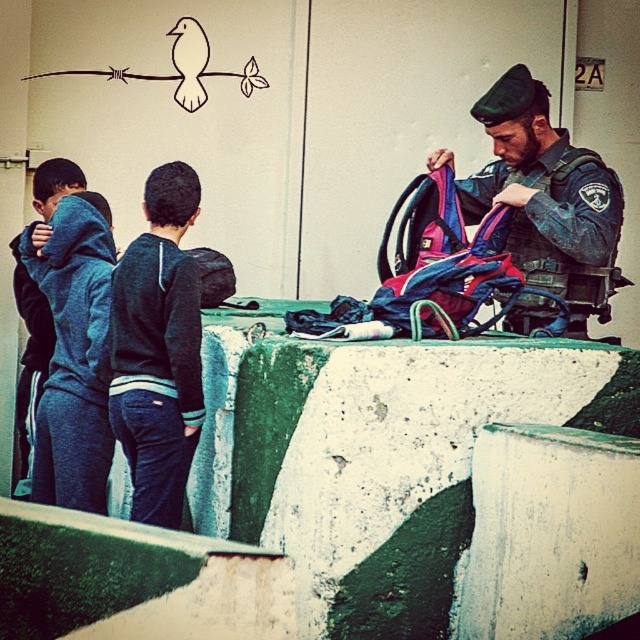
You are a security guard at the checkpoint. You need to determine if the width of the dark green uniform at center is wider than the dark blue hoodie at left. Based on the scene, what is your observation?

The dark green uniform at center is wider than the dark blue hoodie at left according to the description.